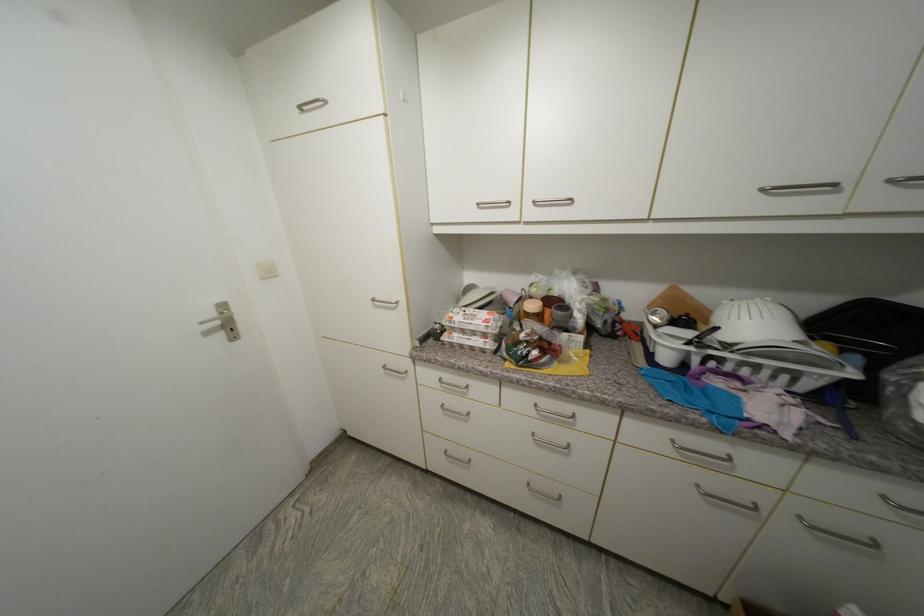
This screenshot has height=616, width=924. I want to click on white light switch, so click(x=265, y=269).